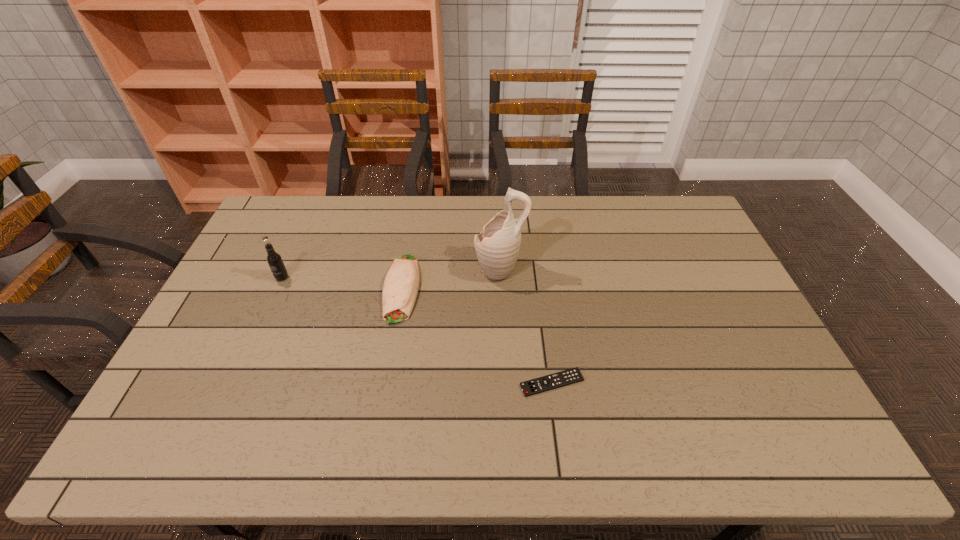
Locate an element on the screen. vacant space that satisfies the following two spatial constraints: 1. at the spout of the pitcher; 2. on the back side of the nearest object is located at coordinates pyautogui.click(x=505, y=382).

You are a GUI agent. You are given a task and a screenshot of the screen. Output one action in this format:
    pyautogui.click(x=<x>, y=<y>)
    Task: Click on the free location that satisfies the following two spatial constraints: 1. at the spout of the tallest object; 2. on the label of the leftmost object
    The height and width of the screenshot is (540, 960).
    Given the screenshot: What is the action you would take?
    pyautogui.click(x=500, y=278)

You are a GUI agent. You are given a task and a screenshot of the screen. Output one action in this format:
    pyautogui.click(x=<x>, y=<y>)
    Task: Click on the vacant space that satisfies the following two spatial constraints: 1. at the spout of the tallest object; 2. on the left side of the nearest object
    Image resolution: width=960 pixels, height=540 pixels.
    Given the screenshot: What is the action you would take?
    pyautogui.click(x=505, y=382)

This screenshot has width=960, height=540. I want to click on vacant area in the image that satisfies the following two spatial constraints: 1. on the back side of the remote control; 2. at the spout of the tallest object, so click(x=537, y=270).

The height and width of the screenshot is (540, 960). What are the coordinates of `vacant space that satisfies the following two spatial constraints: 1. at the spout of the tallest object; 2. at the bitten end of the second shortest object` in the screenshot? It's located at [x=501, y=288].